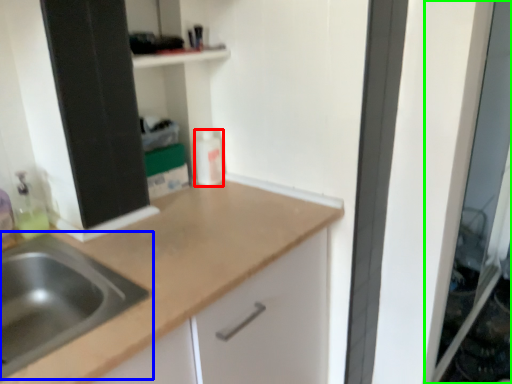
Question: Estimate the real-world distances between objects in this image. Which object is closer to bottle (highlighted by a red box), sink (highlighted by a blue box) or screen door (highlighted by a green box)?

Choices:
 (A) sink
 (B) screen door

Answer: (A)